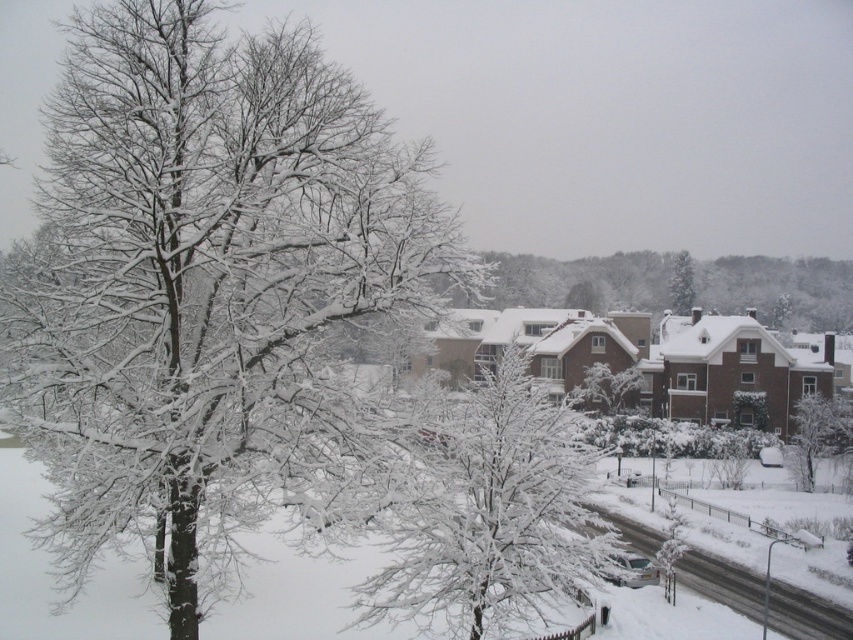
The image size is (853, 640). Identify the location of snow-covered tree at left. (212, 292).

Is the position of snow-covered tree at left less distant than that of white snow-covered tree at center?

Yes, snow-covered tree at left is closer to the viewer.

What do you see at coordinates (212, 292) in the screenshot? I see `snow-covered tree at left` at bounding box center [212, 292].

You are a GUI agent. You are given a task and a screenshot of the screen. Output one action in this format:
    pyautogui.click(x=<x>, y=<y>)
    Task: Click on the snow-covered tree at left
    
    Given the screenshot: What is the action you would take?
    pyautogui.click(x=212, y=292)

Who is positioned more to the right, snow-covered tree at center or white snow-covered tree at center?

Positioned to the right is white snow-covered tree at center.

Is snow-covered tree at center wider than white snow-covered tree at center?

Yes.

This screenshot has height=640, width=853. Identify the location of snow-covered tree at center. (491, 515).

Is white snow-covered tree at center wider than green matte tree at upper center?

A: Yes, white snow-covered tree at center is wider than green matte tree at upper center.

Does point (831, 413) come in front of point (672, 307)?

Yes.

Is point (824, 404) closer to camera compared to point (680, 272)?

Yes, point (824, 404) is closer to viewer.

This screenshot has width=853, height=640. I want to click on white snow-covered tree at center, so click(817, 435).